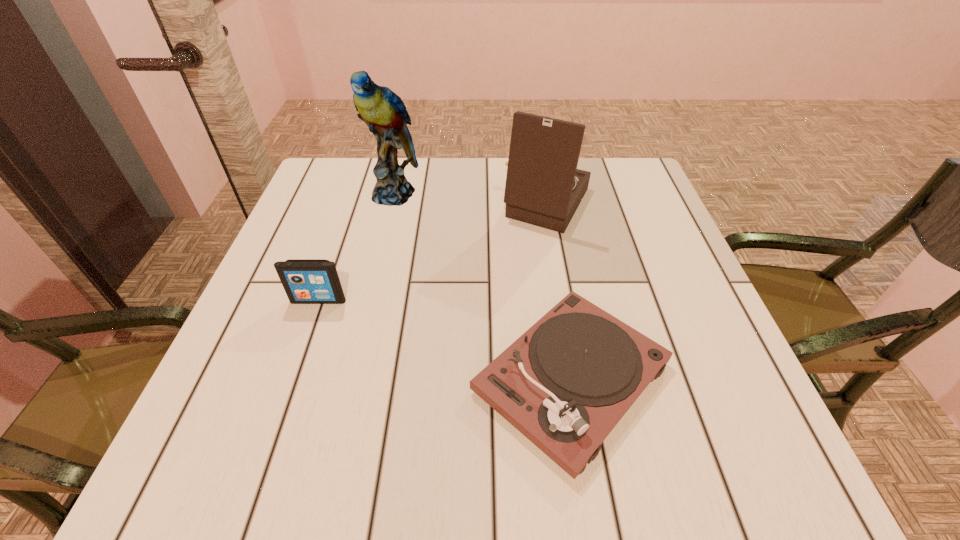
Find the location of a particular element. This screenshot has height=540, width=960. vacant space at the left edge of the desktop is located at coordinates (285, 411).

Find the location of `free point at the right edge`. free point at the right edge is located at coordinates (614, 275).

Where is `vacant space at the far left corner`? This screenshot has height=540, width=960. vacant space at the far left corner is located at coordinates (354, 203).

In the image, there is a desktop. Where is `free region at the near left corner`? free region at the near left corner is located at coordinates (192, 455).

The width and height of the screenshot is (960, 540). I want to click on vacant space at the near right corner, so click(x=683, y=431).

The width and height of the screenshot is (960, 540). I want to click on free space between the iPod and the shortest object, so click(444, 339).

The image size is (960, 540). Identify the location of vacant region between the nearer phonograph_record and the tallest object. (483, 286).

This screenshot has height=540, width=960. Identify the location of vacant area between the tallest object and the farther phonograph_record. (470, 199).

Locate an element on the screen. Image resolution: width=960 pixels, height=540 pixels. vacant area between the parrot and the taller phonograph_record is located at coordinates (470, 199).

The width and height of the screenshot is (960, 540). I want to click on vacant space in between the tallest object and the shortest object, so click(x=483, y=286).